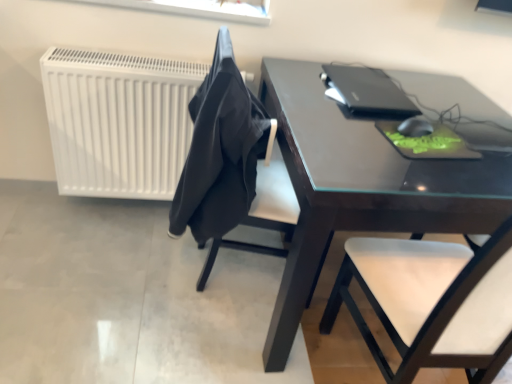
Question: From the image's perspective, does black fabric at center appear lower than black matte laptop at upper right?

Choices:
 (A) yes
 (B) no

Answer: (A)

Question: Are black fabric at center and black matte laptop at upper right located far from each other?

Choices:
 (A) no
 (B) yes

Answer: (A)

Question: Can black matte laptop at upper right be found inside black fabric at center?

Choices:
 (A) yes
 (B) no

Answer: (B)

Question: Does black fabric at center appear on the right side of black matte laptop at upper right?

Choices:
 (A) yes
 (B) no

Answer: (B)

Question: From a real-world perspective, is black fabric at center on top of black matte laptop at upper right?

Choices:
 (A) no
 (B) yes

Answer: (A)

Question: From the image's perspective, is black fabric at center on black matte laptop at upper right?

Choices:
 (A) no
 (B) yes

Answer: (A)

Question: From the image's perspective, is dark brown glossy table at center above black fabric chair at center?

Choices:
 (A) no
 (B) yes

Answer: (A)

Question: Considering the relative sizes of dark brown glossy table at center and black fabric chair at center in the image provided, is dark brown glossy table at center wider than black fabric chair at center?

Choices:
 (A) yes
 (B) no

Answer: (A)

Question: Are dark brown glossy table at center and black fabric chair at center beside each other?

Choices:
 (A) yes
 (B) no

Answer: (B)

Question: Would you say dark brown glossy table at center is outside black fabric chair at center?

Choices:
 (A) no
 (B) yes

Answer: (B)

Question: Is dark brown glossy table at center to the right of black fabric chair at center from the viewer's perspective?

Choices:
 (A) yes
 (B) no

Answer: (A)

Question: Is dark brown glossy table at center thinner than black fabric chair at center?

Choices:
 (A) yes
 (B) no

Answer: (B)

Question: Considering the relative sizes of white matte radiator at left and dark brown glossy table at center in the image provided, is white matte radiator at left smaller than dark brown glossy table at center?

Choices:
 (A) yes
 (B) no

Answer: (A)